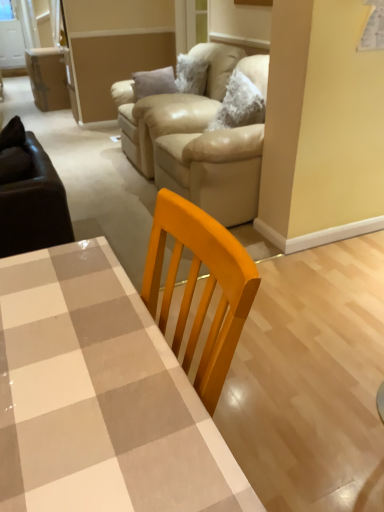
Question: In terms of width, does beige leather couch at upper center look wider or thinner when compared to beige leather armchair at upper center?

Choices:
 (A) wide
 (B) thin

Answer: (B)

Question: Is beige leather couch at upper center taller or shorter than beige leather armchair at upper center?

Choices:
 (A) short
 (B) tall

Answer: (B)

Question: Which of these objects is positioned closest to the beige leather couch at upper center?

Choices:
 (A) checkered glossy table at center
 (B) beige leather armchair at upper center

Answer: (B)

Question: Which object is positioned farthest from the beige leather couch at upper center?

Choices:
 (A) checkered glossy table at center
 (B) beige leather armchair at upper center

Answer: (A)